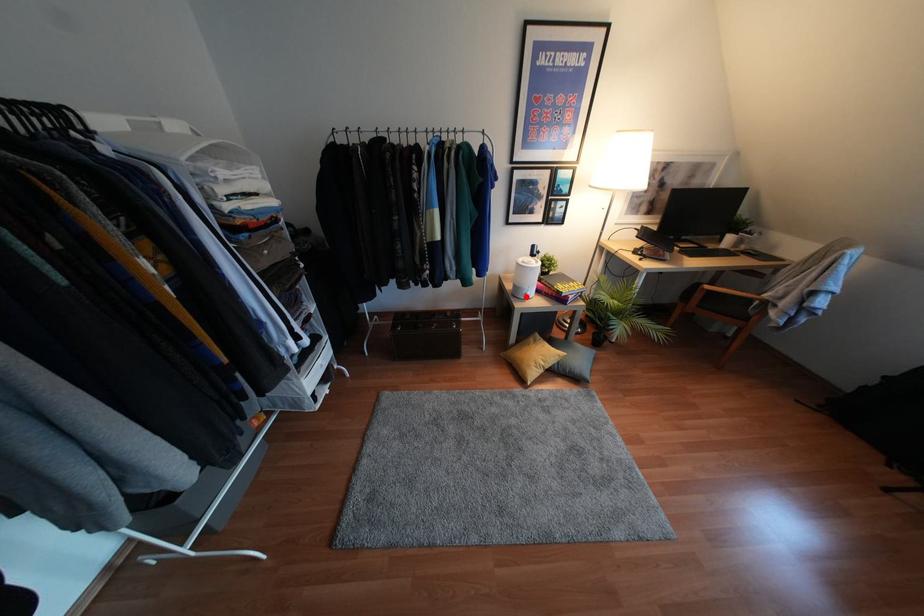
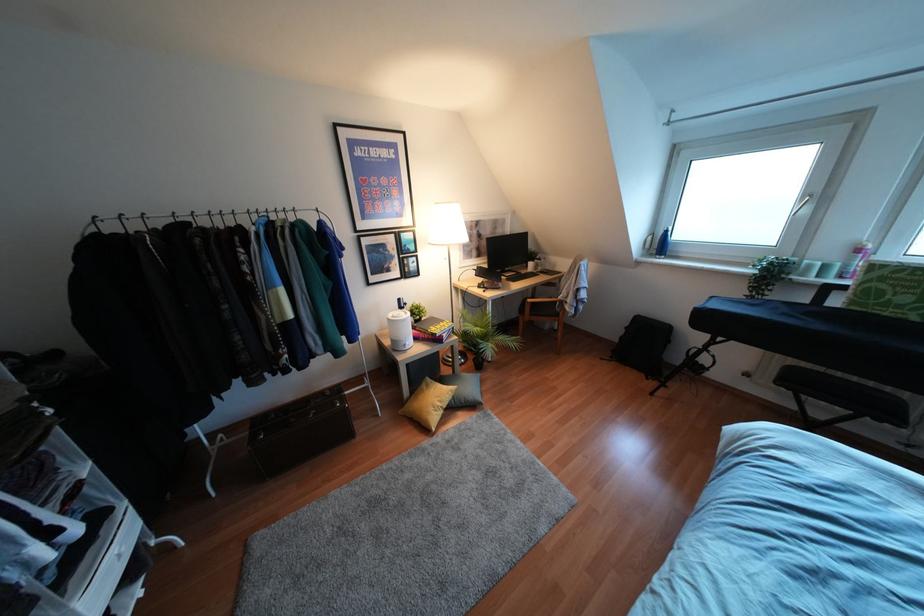
Where in the second image is the point corresponding to the highlighted location from the first image?

(407, 347)